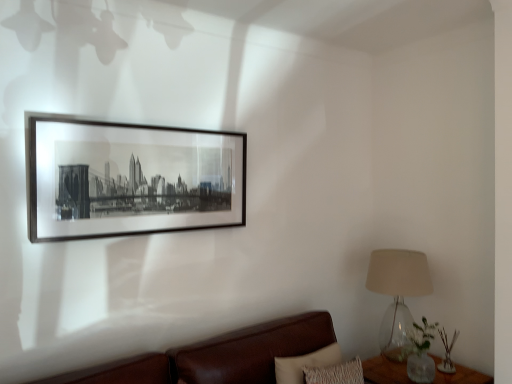
Where is `green glass vase at lower right`? This screenshot has height=384, width=512. green glass vase at lower right is located at coordinates (447, 351).

The height and width of the screenshot is (384, 512). What do you see at coordinates (385, 371) in the screenshot? I see `clear glass table at lower right` at bounding box center [385, 371].

Measure the distance between point [467,379] and camera.

2.46 meters.

What is the approximate width of translucent glass lampshade at right?

translucent glass lampshade at right is 15.15 inches wide.

What is the approximate height of brown leather couch at lower right?

brown leather couch at lower right is 20.04 inches in height.

Locate an element on the screen. The height and width of the screenshot is (384, 512). green glass vase at lower right is located at coordinates (447, 351).

Consider the image. Is translucent glass lampshade at right looking in the opposite direction of green glass vase at lower right?

No, translucent glass lampshade at right is not facing the opposite direction of green glass vase at lower right.

Considering the sizes of objects translucent glass lampshade at right and green glass vase at lower right in the image provided, who is taller, translucent glass lampshade at right or green glass vase at lower right?

translucent glass lampshade at right.

Consider the image. How many degrees apart are the facing directions of translucent glass lampshade at right and green glass vase at lower right?

The angular difference between translucent glass lampshade at right and green glass vase at lower right is 0.296 degrees.

Relative to clear glass table at lower right, is black matte picture frame at upper center in front or behind?

Visually, black matte picture frame at upper center is located in front of clear glass table at lower right.

From a real-world perspective, is black matte picture frame at upper center above or below clear glass table at lower right?

In terms of real-world spatial position, black matte picture frame at upper center is above clear glass table at lower right.

Which object is positioned more to the left, black matte picture frame at upper center or clear glass table at lower right?

From the viewer's perspective, black matte picture frame at upper center appears more on the left side.

Are black matte picture frame at upper center and clear glass table at lower right making contact?

There is a gap between black matte picture frame at upper center and clear glass table at lower right.

Consider the image. From a real-world perspective, does green glass vase at lower right stand above brown leather couch at lower right?

Yes, from a real-world perspective, green glass vase at lower right is above brown leather couch at lower right.

Considering the relative sizes of green glass vase at lower right and brown leather couch at lower right in the image provided, is green glass vase at lower right taller than brown leather couch at lower right?

No.

Which is in front, point (441, 369) or point (222, 339)?

The point (222, 339) is more forward.

Is green glass vase at lower right beside brown leather couch at lower right?

green glass vase at lower right and brown leather couch at lower right are clearly separated.

Is translucent glass lampshade at right completely or partially inside clear glass table at lower right?

No, translucent glass lampshade at right is not inside clear glass table at lower right.

Can you confirm if clear glass table at lower right is taller than translucent glass lampshade at right?

Incorrect, the height of clear glass table at lower right is not larger of that of translucent glass lampshade at right.

Considering the sizes of clear glass table at lower right and translucent glass lampshade at right in the image, is clear glass table at lower right wider or thinner than translucent glass lampshade at right?

clear glass table at lower right is wider than translucent glass lampshade at right.

What's the angular difference between clear glass table at lower right and translucent glass lampshade at right's facing directions?

0.443 degrees separate the facing orientations of clear glass table at lower right and translucent glass lampshade at right.

Can you confirm if brown leather couch at lower right is shorter than clear glass table at lower right?

In fact, brown leather couch at lower right may be taller than clear glass table at lower right.

From the image's perspective, which one is positioned lower, brown leather couch at lower right or clear glass table at lower right?

clear glass table at lower right.

Are brown leather couch at lower right and clear glass table at lower right beside each other?

No, brown leather couch at lower right is not beside clear glass table at lower right.

Which of these two, brown leather couch at lower right or clear glass table at lower right, is thinner?

clear glass table at lower right.

Where is `plant above the clear glass table at lower right (from the image's perspective)`? Image resolution: width=512 pixels, height=384 pixels. plant above the clear glass table at lower right (from the image's perspective) is located at coordinates (447, 351).

Is clear glass table at lower right wider than green glass vase at lower right?

Indeed, clear glass table at lower right has a greater width compared to green glass vase at lower right.

Is clear glass table at lower right positioned far away from green glass vase at lower right?

No.

Based on the photo, could you measure the distance between brown leather couch at lower right and black matte picture frame at upper center?

The distance of brown leather couch at lower right from black matte picture frame at upper center is 80.73 centimeters.

Which of these two, brown leather couch at lower right or black matte picture frame at upper center, is bigger?

With larger size is brown leather couch at lower right.

Is black matte picture frame at upper center at the back of brown leather couch at lower right?

No, black matte picture frame at upper center is not at the back of brown leather couch at lower right.

From the image's perspective, is brown leather couch at lower right above black matte picture frame at upper center?

No, from the image's perspective, brown leather couch at lower right is not over black matte picture frame at upper center.

Identify the location of plant located behind the translucent glass lampshade at right. (447, 351).

What are the coordinates of `picture frame in front of the clear glass table at lower right` in the screenshot? It's located at (129, 178).

When comparing their distances from black matte picture frame at upper center, does clear glass table at lower right or translucent glass lampshade at right seem closer?

translucent glass lampshade at right.

Which object lies further to the anchor point green glass vase at lower right, brown leather couch at lower right or clear glass table at lower right?

Based on the image, brown leather couch at lower right appears to be further to green glass vase at lower right.

When comparing their distances from clear glass table at lower right, does green glass vase at lower right or translucent glass lampshade at right seem further?

translucent glass lampshade at right is positioned further to the anchor clear glass table at lower right.

Which object lies further to the anchor point clear glass table at lower right, translucent glass lampshade at right or green glass vase at lower right?

translucent glass lampshade at right is further to clear glass table at lower right.

Looking at the image, which one is located closer to black matte picture frame at upper center, clear glass table at lower right or brown leather couch at lower right?

brown leather couch at lower right is positioned closer to the anchor black matte picture frame at upper center.

Based on their spatial positions, is black matte picture frame at upper center or brown leather couch at lower right further from clear glass table at lower right?

black matte picture frame at upper center lies further to clear glass table at lower right than the other object.

Estimate the real-world distances between objects in this image. Which object is closer to brown leather couch at lower right, black matte picture frame at upper center or clear glass table at lower right?

Based on the image, clear glass table at lower right appears to be nearer to brown leather couch at lower right.

Considering their positions, is brown leather couch at lower right positioned further to green glass vase at lower right than black matte picture frame at upper center?

black matte picture frame at upper center is further to green glass vase at lower right.

Find the location of a particular element. The width and height of the screenshot is (512, 384). table between brown leather couch at lower right and translucent glass lampshade at right along the z-axis is located at coordinates (385, 371).

I want to click on table lamp situated between black matte picture frame at upper center and clear glass table at lower right from left to right, so click(x=398, y=295).

I want to click on plant between translucent glass lampshade at right and clear glass table at lower right from top to bottom, so click(x=447, y=351).

This screenshot has width=512, height=384. What are the coordinates of `table lamp situated between black matte picture frame at upper center and green glass vase at lower right from left to right` in the screenshot? It's located at (398, 295).